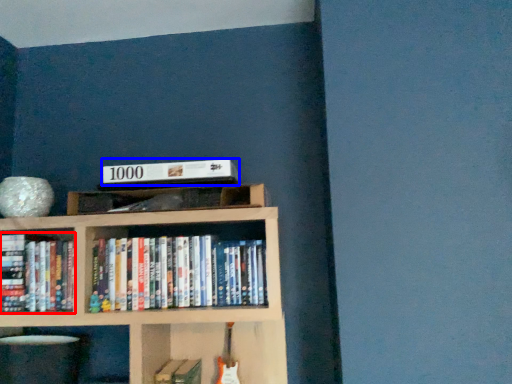
Question: Which point is further to the camera, book (highlighted by a red box) or paperback book (highlighted by a blue box)?

Choices:
 (A) book
 (B) paperback book

Answer: (A)